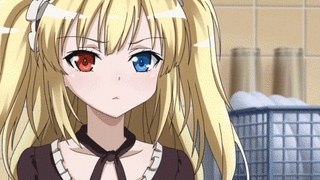
Locate an element on the screen. light gray dishes in rack is located at coordinates (246, 105), (269, 98), (290, 104).